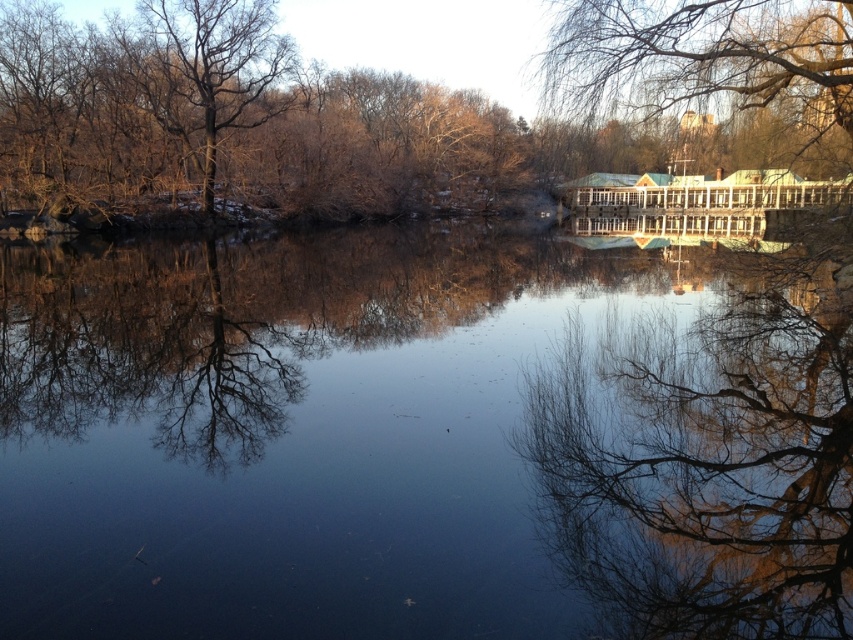
Between brown leafless tree at upper center and bare branches at upper left, which one is positioned higher?

bare branches at upper left

Is the position of brown leafless tree at upper center more distant than that of bare branches at upper left?

No, it is not.

Who is more distant from viewer, (x=399, y=161) or (x=250, y=80)?

The point (x=399, y=161) is behind.

Where is `brown leafless tree at upper center`? This screenshot has width=853, height=640. brown leafless tree at upper center is located at coordinates (392, 106).

Between transparent glass river at center and green leafy tree at upper right, which one has less height?

green leafy tree at upper right

Between point (67, 294) and point (738, 26), which one is positioned in front?

Positioned in front is point (738, 26).

Locate an element on the screen. transparent glass river at center is located at coordinates (296, 429).

Which of these two, transparent glass river at center or bare branches at upper left, stands shorter?

transparent glass river at center is shorter.

Does transparent glass river at center appear under bare branches at upper left?

Yes.

The width and height of the screenshot is (853, 640). What do you see at coordinates (296, 429) in the screenshot? I see `transparent glass river at center` at bounding box center [296, 429].

Where is `transparent glass river at center`? transparent glass river at center is located at coordinates (296, 429).